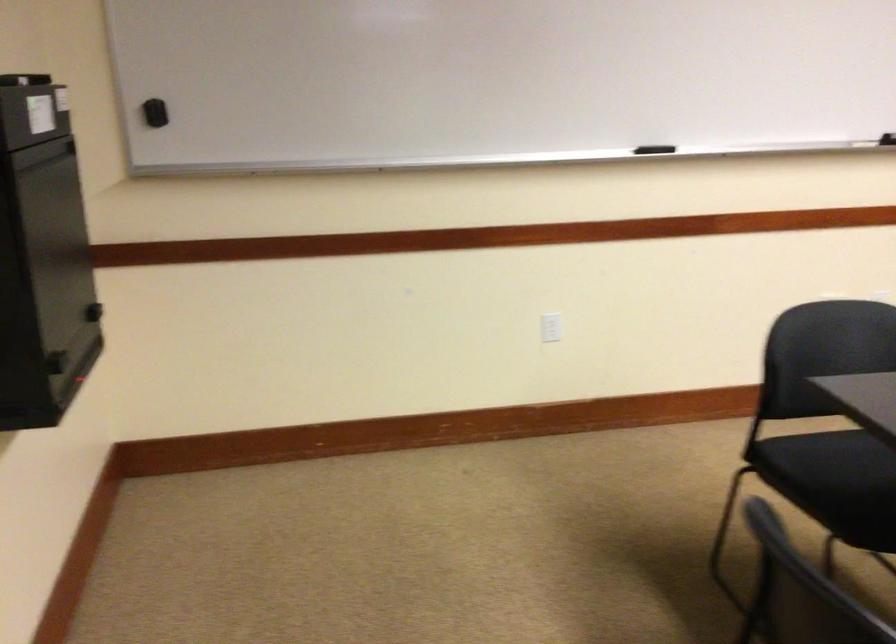
Locate an element on the screen. This screenshot has height=644, width=896. black whiteboard marker is located at coordinates (867, 143).